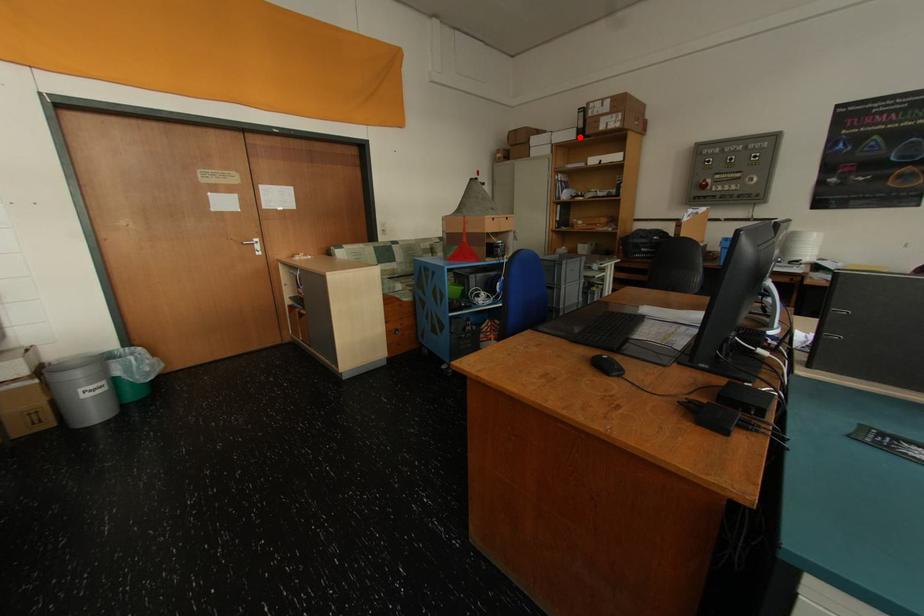
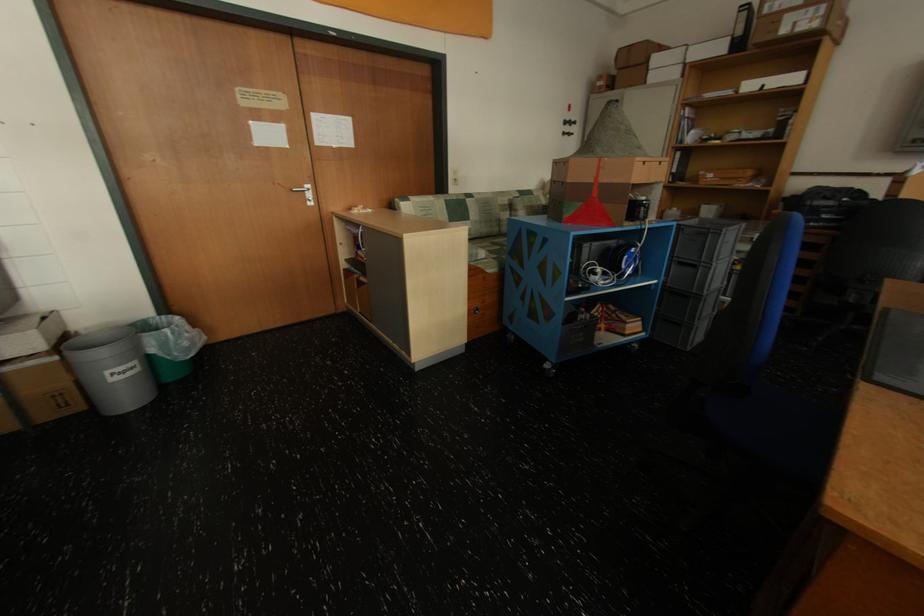
The point at the highlighted location is marked in the first image. Where is the corresponding point in the second image?

(728, 50)